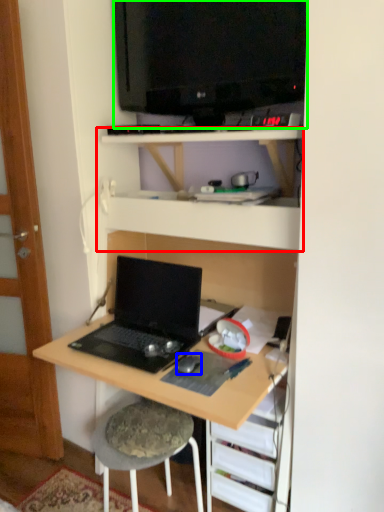
Question: Which object is positioned closest to shelf (highlighted by a red box)? Select from mouse (highlighted by a blue box) and television (highlighted by a green box).

Choices:
 (A) mouse
 (B) television

Answer: (B)